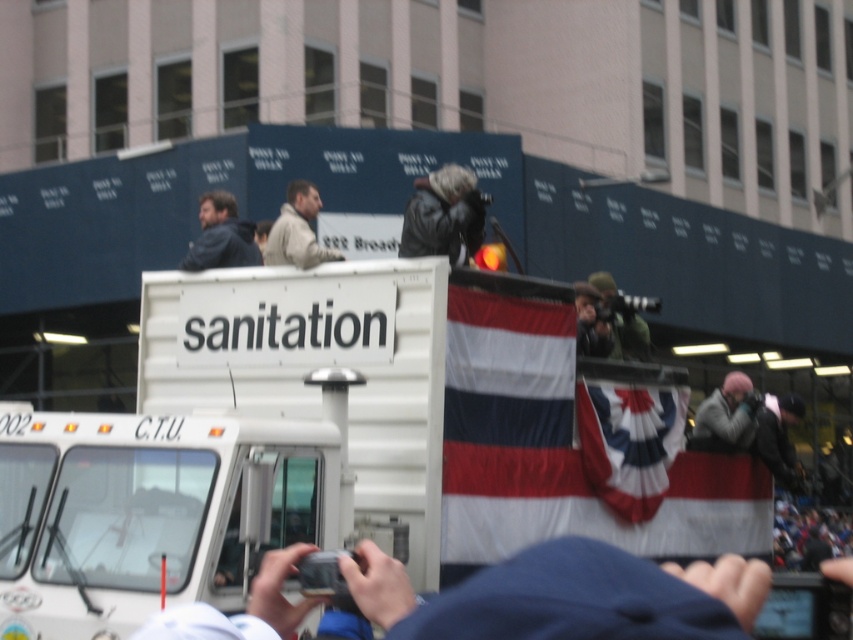
Question: Can you confirm if red fabric flag at center is positioned above dark blue jacket at upper left?

Choices:
 (A) no
 (B) yes

Answer: (A)

Question: Can you confirm if leather jacket at center is positioned below dark blue jacket at upper left?

Choices:
 (A) no
 (B) yes

Answer: (B)

Question: From the image, what is the correct spatial relationship of red fabric flag at center in relation to leather jacket at center?

Choices:
 (A) left
 (B) right

Answer: (B)

Question: Based on their relative distances, which object is nearer to the gray fabric jacket at lower right?

Choices:
 (A) dark blue jacket at upper left
 (B) leather jacket at center
 (C) light beige jacket at center
 (D) red fabric flag at center

Answer: (D)

Question: Which of the following is the farthest from the observer?

Choices:
 (A) (614, 394)
 (B) (302, 253)

Answer: (A)

Question: Which point appears closest to the camera in this image?

Choices:
 (A) (715, 426)
 (B) (293, 205)
 (C) (590, 484)
 (D) (437, 240)

Answer: (D)